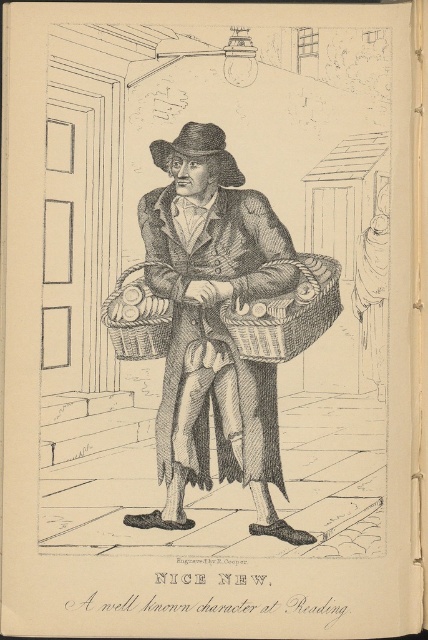
The height and width of the screenshot is (640, 428). What do you see at coordinates (213, 326) in the screenshot?
I see `brown wicker basket at center` at bounding box center [213, 326].

Who is more distant from viewer, (139,218) or (235,180)?

Point (139,218)

Between point (205, 454) and point (166, 150), which one is positioned in front?

Positioned in front is point (166, 150).

I want to click on brown wicker basket at center, so click(x=213, y=326).